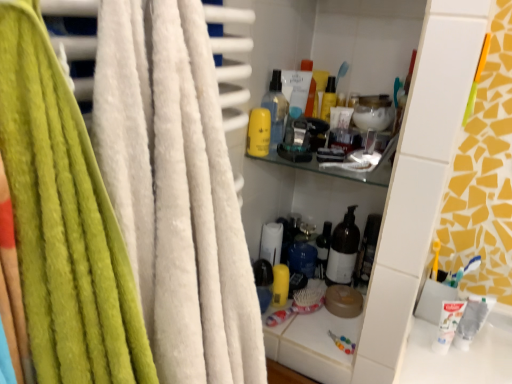
Question: Should I look upward or downward to see yellow matte lotion at upper center?

Choices:
 (A) up
 (B) down

Answer: (A)

Question: Can you see white matte toothpaste at lower right touching blue plastic toothbrush at lower right?

Choices:
 (A) no
 (B) yes

Answer: (B)

Question: Can you confirm if white matte toothpaste at lower right is positioned to the left of blue plastic toothbrush at lower right?

Choices:
 (A) yes
 (B) no

Answer: (A)

Question: Can you confirm if white matte toothpaste at lower right is smaller than blue plastic toothbrush at lower right?

Choices:
 (A) no
 (B) yes

Answer: (A)

Question: Is white matte toothpaste at lower right taller than blue plastic toothbrush at lower right?

Choices:
 (A) yes
 (B) no

Answer: (A)

Question: From a real-world perspective, is white matte toothpaste at lower right below blue plastic toothbrush at lower right?

Choices:
 (A) yes
 (B) no

Answer: (A)

Question: Is white matte toothpaste at lower right not inside blue plastic toothbrush at lower right?

Choices:
 (A) no
 (B) yes

Answer: (B)

Question: Does yellow matte lotion at upper center contain translucent glass bottle at center, which appears as the first bottle when viewed from the right?

Choices:
 (A) yes
 (B) no

Answer: (B)

Question: Is yellow matte lotion at upper center positioned in front of translucent glass bottle at center, marked as the first bottle in a back-to-front arrangement?

Choices:
 (A) no
 (B) yes

Answer: (B)

Question: Does yellow matte lotion at upper center have a larger size compared to translucent glass bottle at center, which is the second bottle in front-to-back order?

Choices:
 (A) no
 (B) yes

Answer: (B)

Question: From a real-world perspective, is yellow matte lotion at upper center physically above translucent glass bottle at center, the second bottle from the left?

Choices:
 (A) yes
 (B) no

Answer: (A)

Question: Does yellow matte lotion at upper center have a greater height compared to translucent glass bottle at center, the second bottle from the left?

Choices:
 (A) yes
 (B) no

Answer: (B)

Question: Can you confirm if yellow matte lotion at upper center is positioned to the right of translucent glass bottle at center, which is the second bottle in front-to-back order?

Choices:
 (A) yes
 (B) no

Answer: (B)

Question: Can you confirm if yellow matte lotion at upper center is positioned to the right of translucent plastic spray bottle at upper center, the 1th bottle positioned from the top?

Choices:
 (A) yes
 (B) no

Answer: (B)